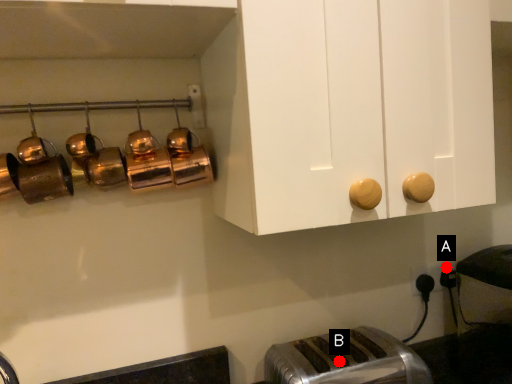
Question: Two points are circled on the image, labeled by A and B beside each circle. Which point is farther to the camera?

Choices:
 (A) A is further
 (B) B is further

Answer: (A)